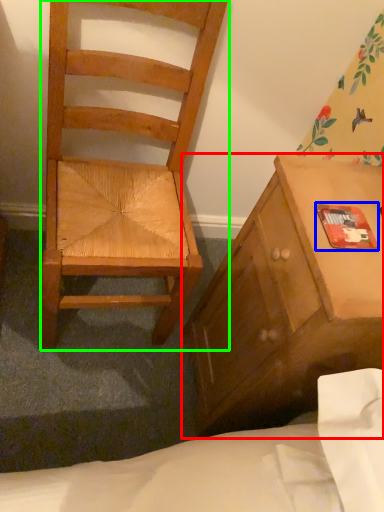
Question: Which object is the closest to the cabinetry (highlighted by a red box)? Choose among these: paperback book (highlighted by a blue box) or chair (highlighted by a green box).

Choices:
 (A) paperback book
 (B) chair

Answer: (A)